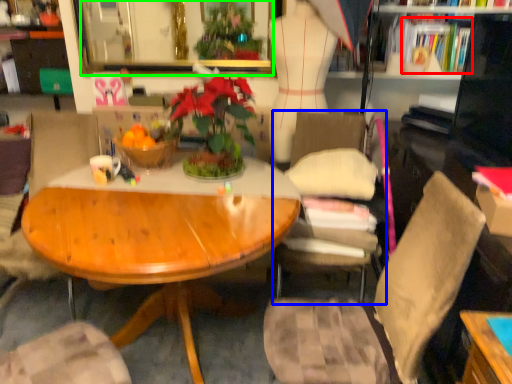
Question: Estimate the real-world distances between objects in this image. Which object is closer to book (highlighted by a red box), chair (highlighted by a blue box) or mirror (highlighted by a green box)?

Choices:
 (A) chair
 (B) mirror

Answer: (A)